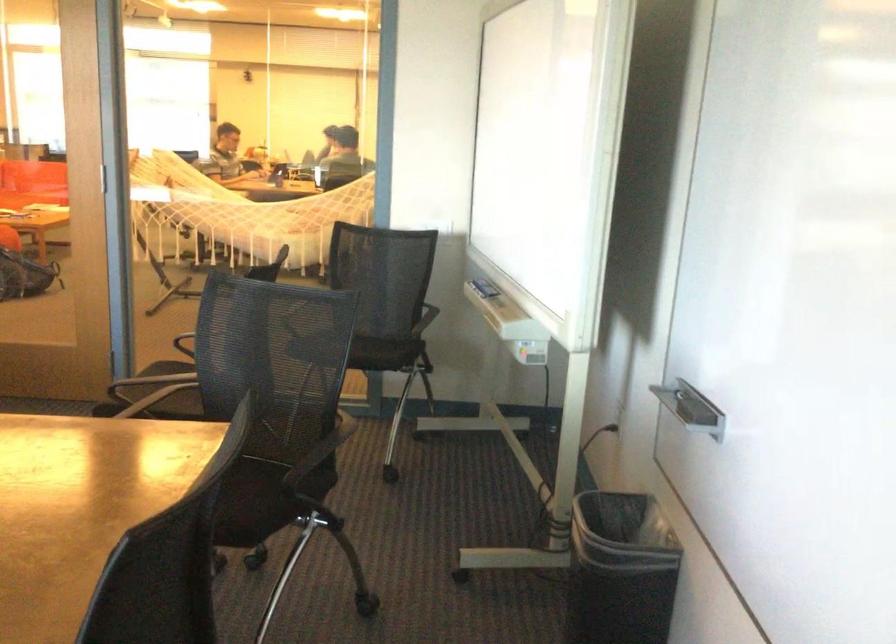
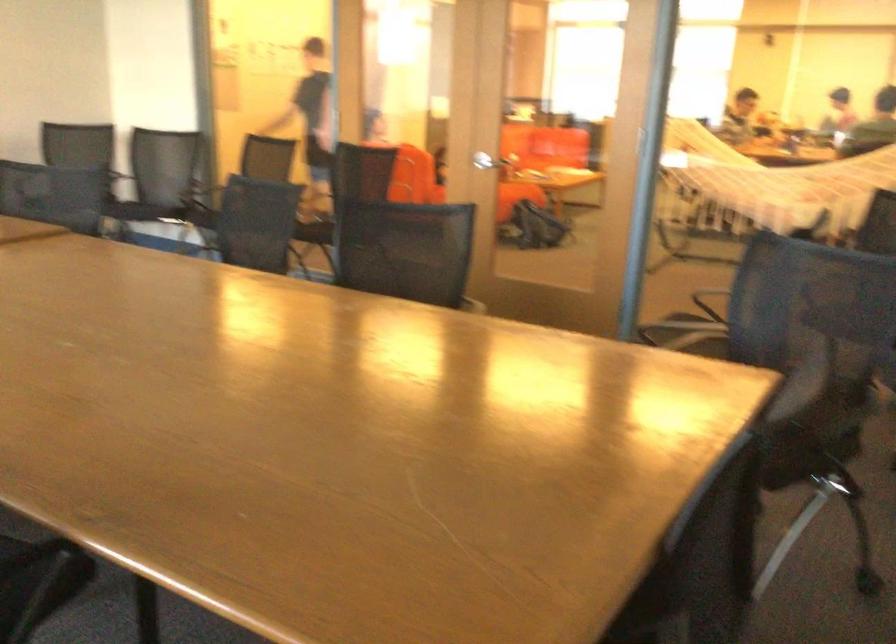
Question: I am providing you with two images of the same scene from different viewpoints. Which of the following objects are not visible in image2?

Choices:
 (A) hammock sitting surface
 (B) white net hammock
 (C) chair sitting surface
 (D) red measuring cup

Answer: (A)